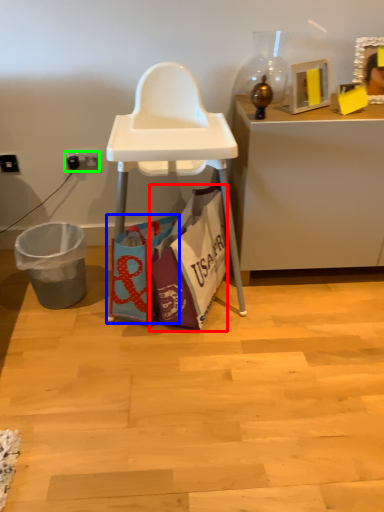
Question: Which is nearer to the handbag (highlighted by a red box)? handbag (highlighted by a blue box) or power outlet (highlighted by a green box).

Choices:
 (A) handbag
 (B) power outlet

Answer: (A)